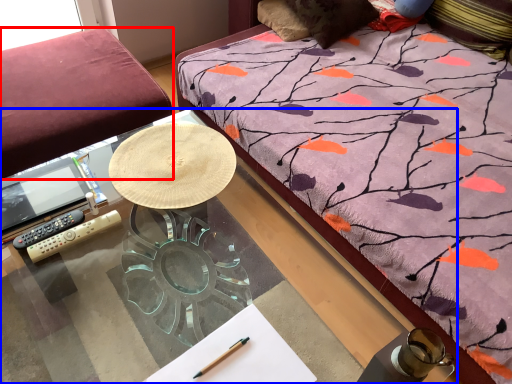
Question: Which point is closer to the camera, studio couch (highlighted by a red box) or desk (highlighted by a blue box)?

Choices:
 (A) studio couch
 (B) desk

Answer: (B)